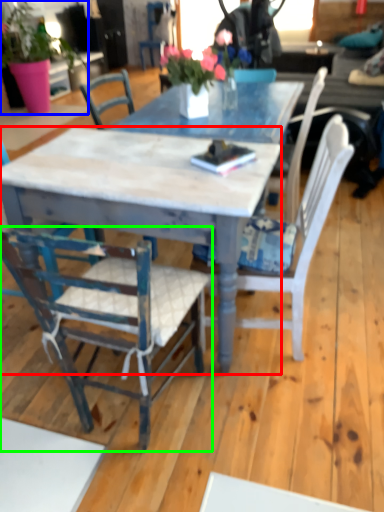
Question: Which object is the farthest from desk (highlighted by a red box)? Choose among these: houseplant (highlighted by a blue box) or chair (highlighted by a green box).

Choices:
 (A) houseplant
 (B) chair

Answer: (A)